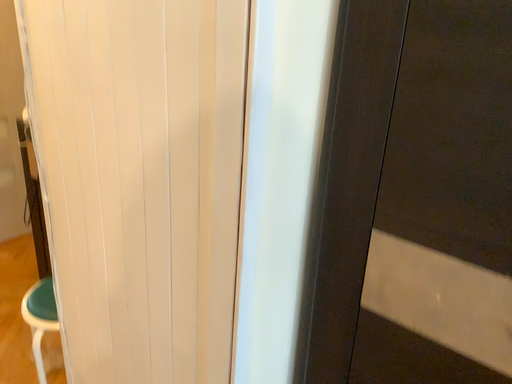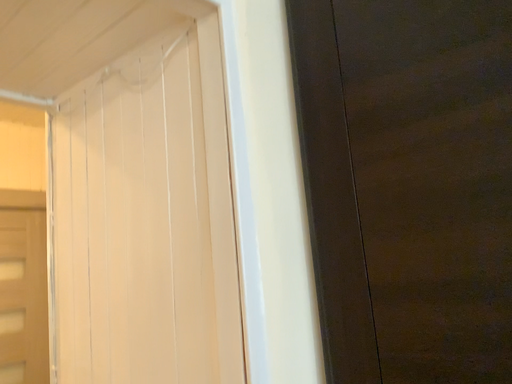
Question: Which way did the camera rotate in the video?

Choices:
 (A) rotated downward
 (B) rotated upward

Answer: (B)